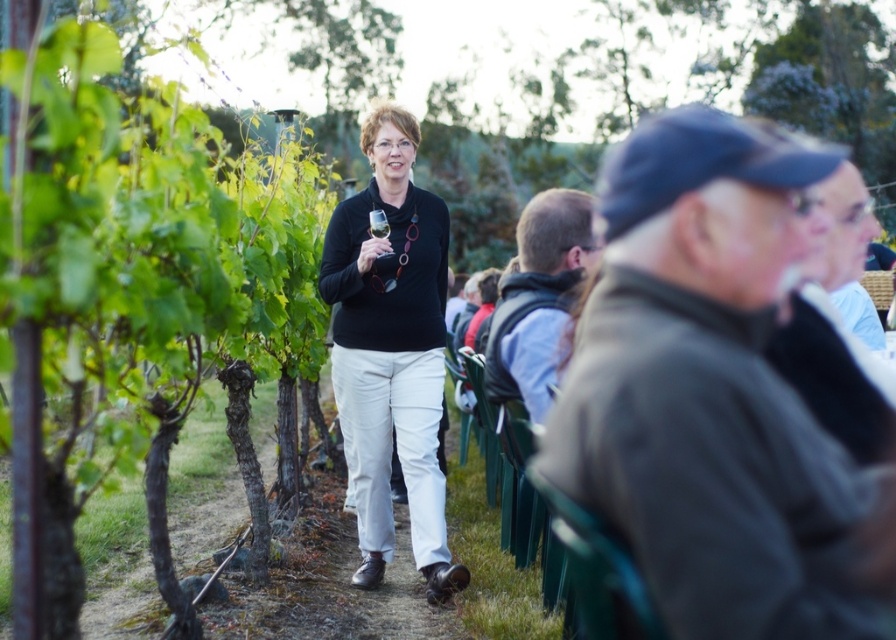
Is point (784, 611) more distant than point (521, 259)?

No, it is in front of (521, 259).

Can you confirm if dark brown leather jacket at right is positioned to the right of light brown leather jacket at center?

Indeed, dark brown leather jacket at right is positioned on the right side of light brown leather jacket at center.

Image resolution: width=896 pixels, height=640 pixels. What do you see at coordinates (714, 388) in the screenshot?
I see `dark brown leather jacket at right` at bounding box center [714, 388].

Locate an element on the screen. The height and width of the screenshot is (640, 896). dark brown leather jacket at right is located at coordinates (714, 388).

Who is higher up, dark brown leather jacket at right or matte black sweater at center?

matte black sweater at center

Describe the element at coordinates (714, 388) in the screenshot. This screenshot has height=640, width=896. I see `dark brown leather jacket at right` at that location.

Identify the location of dark brown leather jacket at right. (714, 388).

You are a GUI agent. You are given a task and a screenshot of the screen. Output one action in this format:
    pyautogui.click(x=<x>, y=<y>)
    Task: Click on the dark brown leather jacket at right
    Image resolution: width=896 pixels, height=640 pixels.
    Given the screenshot: What is the action you would take?
    pyautogui.click(x=714, y=388)

Based on the photo, which is more to the left, gray knit cap at right or light brown leather jacket at center?

From the viewer's perspective, light brown leather jacket at center appears more on the left side.

Is point (853, 358) farther from camera compared to point (556, 308)?

No, it is not.

You are a GUI agent. You are given a task and a screenshot of the screen. Output one action in this format:
    pyautogui.click(x=<x>, y=<y>)
    Task: Click on the gray knit cap at right
    
    Given the screenshot: What is the action you would take?
    pyautogui.click(x=838, y=333)